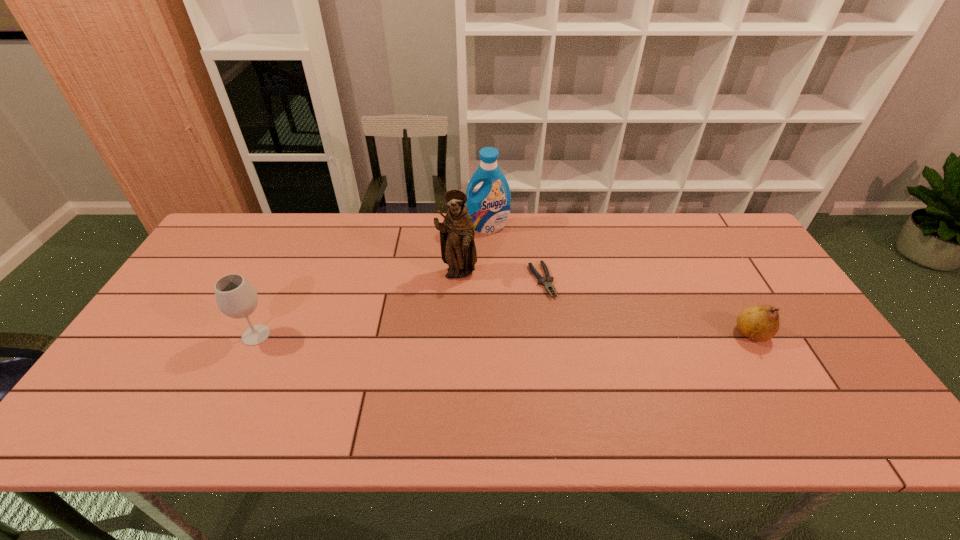
Image resolution: width=960 pixels, height=540 pixels. What are the coordinates of `vacant space on the desktop that is between the leftmost object and the rightmost object and is positioned on the front-facing side of the farthest object` in the screenshot? It's located at (483, 334).

Where is `vacant space on the desktop that is between the third shortest object and the rightmost object and is positioned on the front-facing side of the figurine`? This screenshot has width=960, height=540. vacant space on the desktop that is between the third shortest object and the rightmost object and is positioned on the front-facing side of the figurine is located at coordinates (474, 334).

Locate an element on the screen. vacant space on the desktop that is between the leftmost object and the fourth tallest object and is positioned at the gripping part of the shortest object is located at coordinates (570, 334).